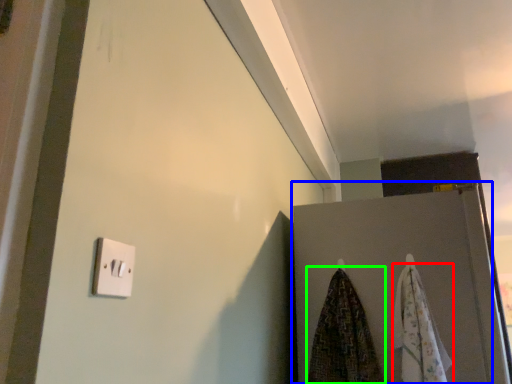
Question: Considering the real-world distances, which object is closest to beach towel (highlighted by a red box)? door (highlighted by a blue box) or beach towel (highlighted by a green box).

Choices:
 (A) door
 (B) beach towel

Answer: (A)